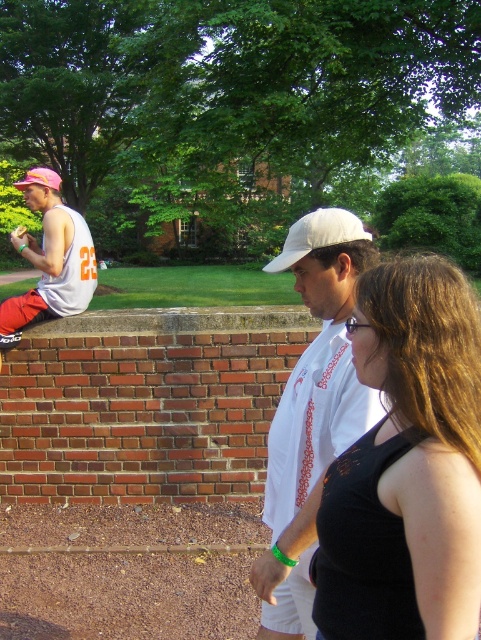
Question: Is white cotton shirt at center bigger than white fabric baseball cap at center?

Choices:
 (A) yes
 (B) no

Answer: (B)

Question: Considering the real-world distances, which object is farthest from the black fabric tank top at center?

Choices:
 (A) matte white tank top at left
 (B) white cotton shirt at center
 (C) pink fabric baseball hat at left

Answer: (C)

Question: Which of the following is the closest to the observer?

Choices:
 (A) white cotton shirt at center
 (B) black fabric tank top at center

Answer: (B)

Question: Does black fabric tank top at center appear over white cotton shirt at center?

Choices:
 (A) yes
 (B) no

Answer: (A)

Question: Which of the following is the closest to the observer?

Choices:
 (A) matte white tank top at left
 (B) pink fabric baseball hat at left
 (C) white cotton shirt at center

Answer: (C)

Question: Is black fabric tank top at center above pink fabric baseball hat at left?

Choices:
 (A) yes
 (B) no

Answer: (B)